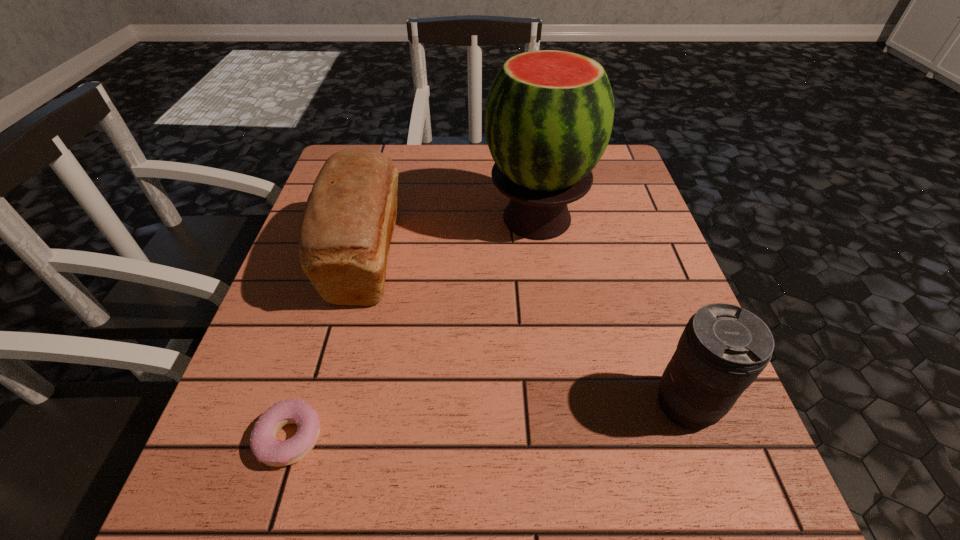
This screenshot has height=540, width=960. In the image, there is a desktop. What are the coordinates of `vacant space at the near edge` in the screenshot? It's located at (379, 537).

This screenshot has width=960, height=540. What are the coordinates of `free space at the left edge` in the screenshot? It's located at (346, 361).

The image size is (960, 540). In the image, there is a desktop. Identify the location of free region at the right edge. (626, 269).

The image size is (960, 540). What are the coordinates of `free space at the far right corner of the desktop` in the screenshot? It's located at (620, 165).

Where is `vacant space at the near right corner of the desktop`? Image resolution: width=960 pixels, height=540 pixels. vacant space at the near right corner of the desktop is located at coordinates (742, 534).

Where is `free space between the telephoto lens and the shortest object`? free space between the telephoto lens and the shortest object is located at coordinates (488, 421).

The height and width of the screenshot is (540, 960). Find the location of `vacant point located between the watermelon and the bread`. vacant point located between the watermelon and the bread is located at coordinates (x=451, y=238).

This screenshot has height=540, width=960. I want to click on free spot between the bread and the rightmost object, so click(x=526, y=331).

You are a GUI agent. You are given a task and a screenshot of the screen. Output one action in this format:
    pyautogui.click(x=<x>, y=<y>)
    Task: Click on the vacant point located between the rightmost object and the third object from left to right
    This screenshot has height=540, width=960.
    Given the screenshot: What is the action you would take?
    pyautogui.click(x=611, y=312)

Identify the location of empty location between the bread and the watermelon. (451, 238).